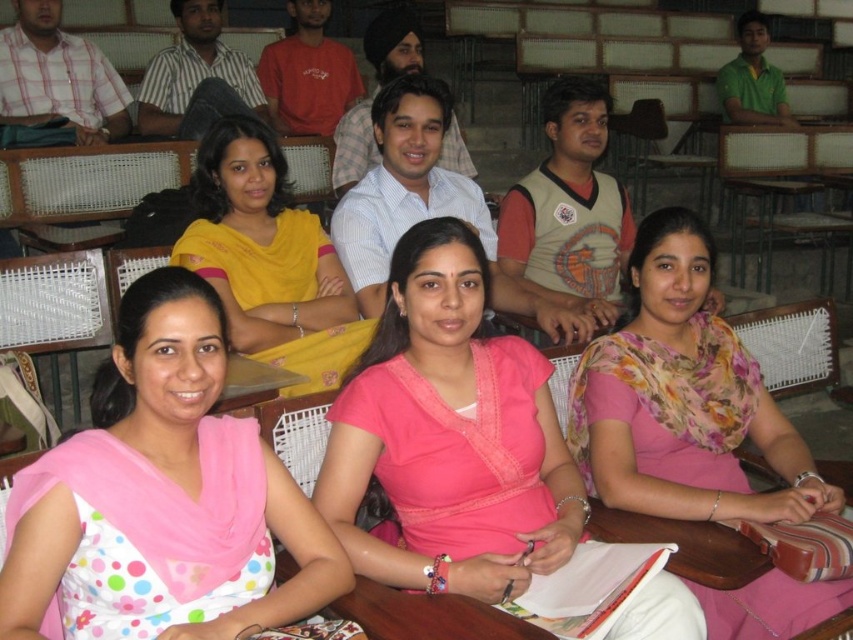
What object is located at the coordinates point (450, 436) in the image?

The point (450, 436) corresponds to the pink satin blouse at center.

You are a photographer standing in the classroom and want to take a photo of both the floral fabric saree at center and the yellow fabric saree at center. Can you fit both in the frame if your camera has a 3.5 feet wide field of view?

The floral fabric saree at center and yellow fabric saree at center are 4.01 feet apart, so they are slightly further apart than the camera can capture in a single frame with a 3.5 feet field of view. The photographer would need to adjust their position or zoom out to include both.

You are standing in the classroom and want to move from point A to point B. The coordinates for point A are point (770, 497) and point B are point (251, 266). According to the image, which point is closer to you?

Point (770, 497) is in front of point (251, 266), so point (770, 497) is closer to you.